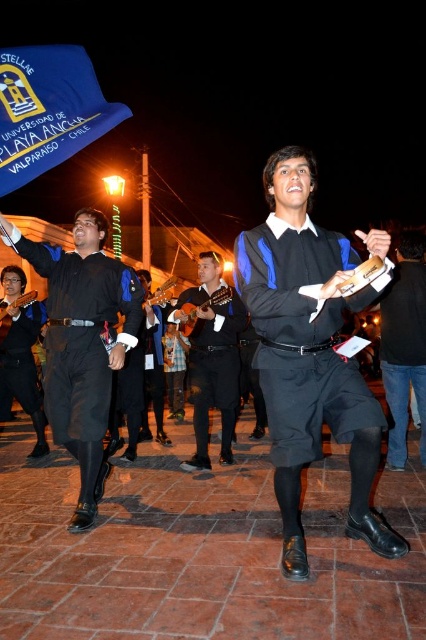
Question: Which point is closer to the camera?

Choices:
 (A) (385, 380)
 (B) (57, 342)
 (C) (310, 230)
 (D) (9, 273)

Answer: (C)

Question: Based on their relative distances, which object is farther from the black leather guitar at center?

Choices:
 (A) matte black guitar at left
 (B) black leather shoes at lower right

Answer: (A)

Question: Which of the following is the farthest from the observer?

Choices:
 (A) black matte shorts at center
 (B) black leather shoes at lower right
 (C) black leather guitar at center

Answer: (C)

Question: Can you confirm if black leather guitar at center is thinner than matte black guitar at left?

Choices:
 (A) no
 (B) yes

Answer: (A)

Question: Is black matte shorts at center bigger than black leather guitar at center?

Choices:
 (A) yes
 (B) no

Answer: (A)

Question: Is black matte shorts at center positioned in front of matte black shirt at left?

Choices:
 (A) no
 (B) yes

Answer: (B)